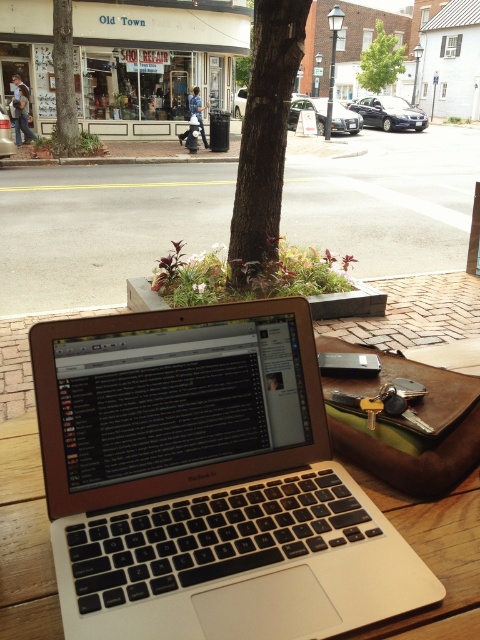
You are a delivery person who needs to place a small package on the table without covering the silver metallic laptop at center or the metallic keys at center. Given that the package is 10 cm in length, which object should you avoid placing the package near to ensure it doesn t get covered?

The silver metallic laptop at center is larger than the metallic keys at center, so you should avoid placing the package near the metallic keys at center to ensure it doesn t get covered.

You are a person who wants to place both the silver metallic laptop at center and the metallic keys at center into a storage box. The box has a height limit of 15 cm. Can both items fit vertically inside the box without exceeding the height limit?

The silver metallic laptop at center is taller than the metallic keys at center. If the laptop is taller than 15 cm, then it won cannot fit. However, if the laptop is shorter than or equal to 15 cm, both can fit. But since we donot have exact measurements, we cannot determine for sure.

You are a person who just arrived at the coffee shop and placed your silver metallic laptop at center on the table. Now you want to reach for the metallic keys at center without moving the laptop. Is this possible?

The silver metallic laptop at center is below the metallic keys at center, so you can reach the metallic keys at center by moving your hand over the laptop since it is positioned above.